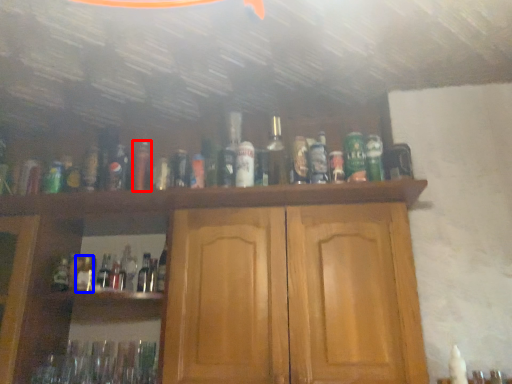
Question: Which object is further to the camera taking this photo, bottle (highlighted by a red box) or bottle (highlighted by a blue box)?

Choices:
 (A) bottle
 (B) bottle

Answer: (B)